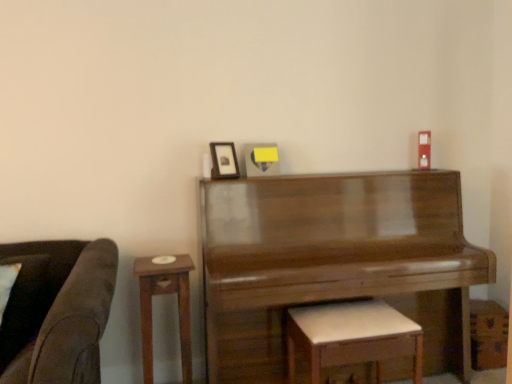
Question: Is matte black picture frame at upper center outside of wooden side table at left?

Choices:
 (A) yes
 (B) no

Answer: (A)

Question: Is matte black picture frame at upper center with wooden side table at left?

Choices:
 (A) yes
 (B) no

Answer: (B)

Question: From the image's perspective, is matte black picture frame at upper center located above wooden side table at left?

Choices:
 (A) yes
 (B) no

Answer: (A)

Question: From a real-world perspective, does matte black picture frame at upper center sit lower than wooden side table at left?

Choices:
 (A) yes
 (B) no

Answer: (B)

Question: Considering the relative positions of matte black picture frame at upper center and wooden side table at left in the image provided, is matte black picture frame at upper center to the left of wooden side table at left from the viewer's perspective?

Choices:
 (A) no
 (B) yes

Answer: (A)

Question: Is matte black picture frame at upper center wider than wooden side table at left?

Choices:
 (A) yes
 (B) no

Answer: (B)

Question: Considering the relative sizes of shiny brown piano at center and matte black picture frame at upper center in the image provided, is shiny brown piano at center taller than matte black picture frame at upper center?

Choices:
 (A) yes
 (B) no

Answer: (A)

Question: Does shiny brown piano at center have a lesser width compared to matte black picture frame at upper center?

Choices:
 (A) no
 (B) yes

Answer: (A)

Question: Is shiny brown piano at center smaller than matte black picture frame at upper center?

Choices:
 (A) no
 (B) yes

Answer: (A)

Question: Is shiny brown piano at center not inside matte black picture frame at upper center?

Choices:
 (A) yes
 (B) no

Answer: (A)

Question: Can you see shiny brown piano at center touching matte black picture frame at upper center?

Choices:
 (A) yes
 (B) no

Answer: (B)

Question: Is shiny brown piano at center in front of matte black picture frame at upper center?

Choices:
 (A) no
 (B) yes

Answer: (B)

Question: Is white leather stool at lower center turned away from shiny brown piano at center?

Choices:
 (A) no
 (B) yes

Answer: (B)